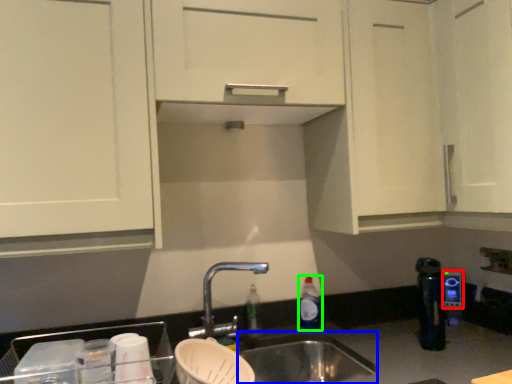
Question: Based on their relative distances, which object is farther from appliance (highlighted by a red box)? Choose from sink (highlighted by a blue box) and bottle (highlighted by a green box).

Choices:
 (A) sink
 (B) bottle

Answer: (A)